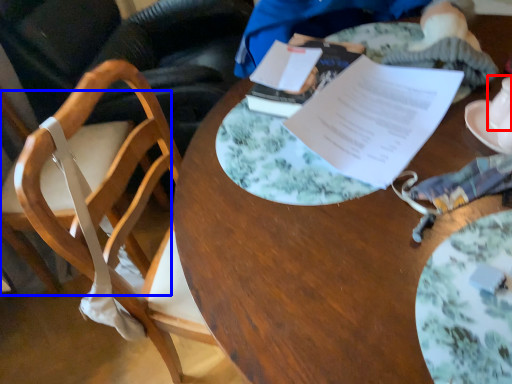
Question: Which object is further to the camera taking this photo, tableware (highlighted by a red box) or chair (highlighted by a blue box)?

Choices:
 (A) tableware
 (B) chair

Answer: (A)